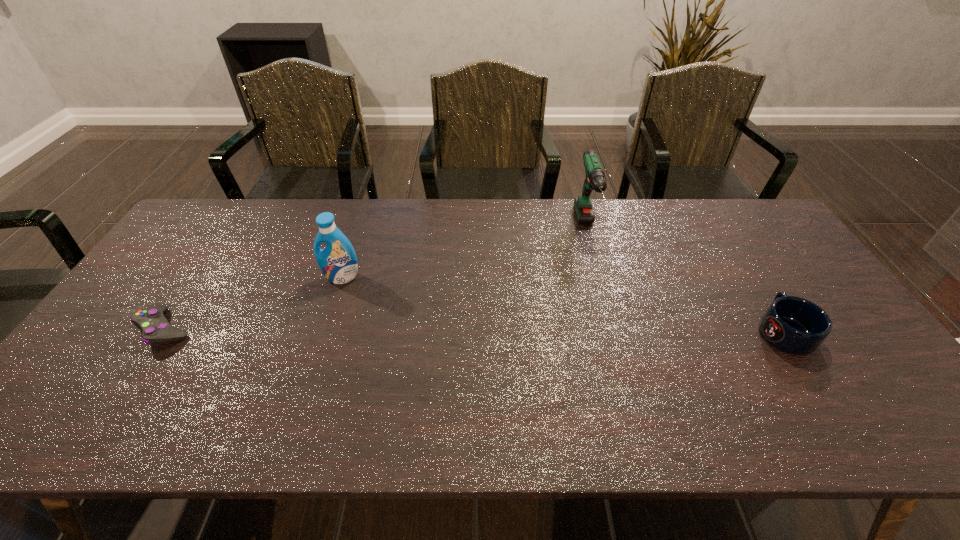
The height and width of the screenshot is (540, 960). Identify the location of vacant position located with the handle on the side of the mug. (723, 234).

Identify the location of free space located 0.140m with the handle on the side of the mug. (747, 273).

The image size is (960, 540). Find the location of `vacant region located 0.270m with the handle on the side of the mug`. vacant region located 0.270m with the handle on the side of the mug is located at coordinates (729, 244).

Identify the location of vacant space situated on the right of the leftmost object. (235, 329).

This screenshot has height=540, width=960. Identify the location of object present at the far edge. (595, 179).

Locate an element on the screen. The width and height of the screenshot is (960, 540). object situated at the left edge is located at coordinates (155, 328).

In order to click on object present at the right edge in this screenshot , I will do `click(794, 325)`.

In order to click on vacant area at the far edge in this screenshot , I will do `click(408, 232)`.

In the image, there is a desktop. Identify the location of free space at the near edge. (588, 424).

Identify the location of vacant space at the left edge of the desktop. The height and width of the screenshot is (540, 960). (191, 279).